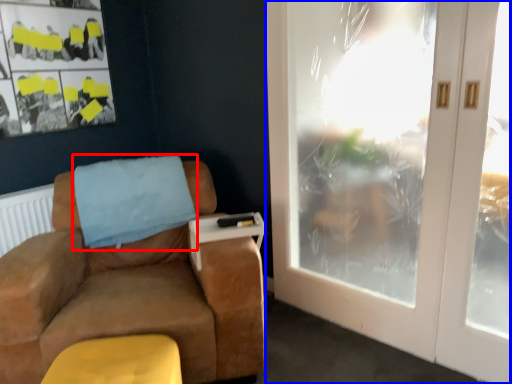
Question: Which object appears closest to the camera in this image, blanket (highlighted by a red box) or door (highlighted by a blue box)?

Choices:
 (A) blanket
 (B) door

Answer: (B)